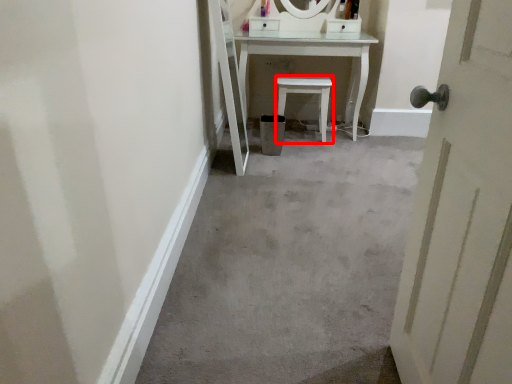
Question: From the image, what is the correct spatial relationship of furniture (annotated by the red box) in relation to door?

Choices:
 (A) right
 (B) left

Answer: (B)